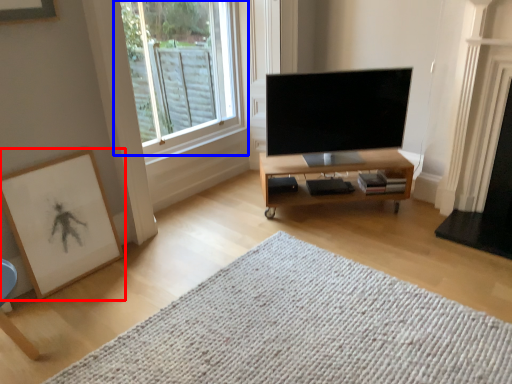
Question: Which object is closer to the camera taking this photo, picture frame (highlighted by a red box) or window (highlighted by a blue box)?

Choices:
 (A) picture frame
 (B) window

Answer: (A)